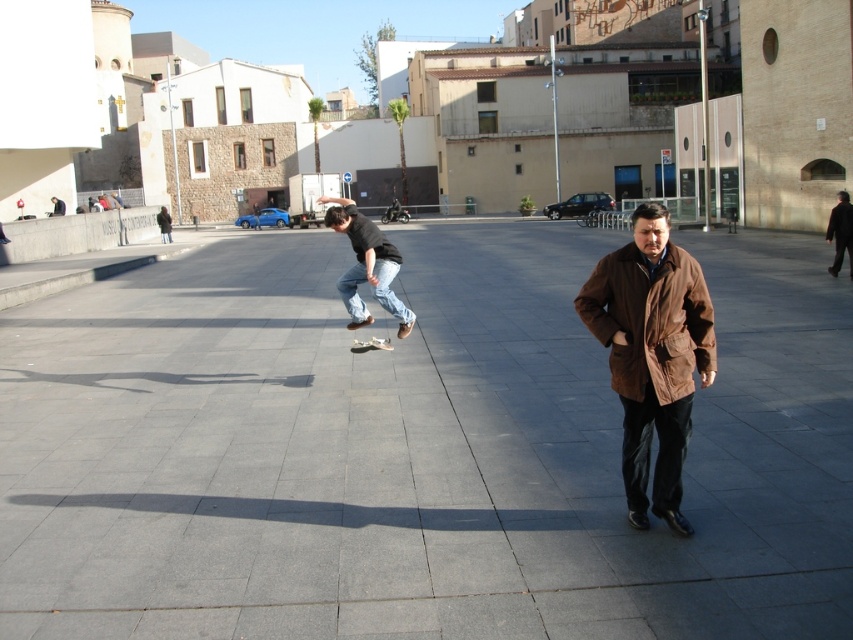
The image size is (853, 640). What do you see at coordinates (415, 451) in the screenshot?
I see `gray concrete pavement at center` at bounding box center [415, 451].

Between point (486, 570) and point (846, 248), which one is positioned in front?

Point (486, 570)

At what (x,y) coordinates should I click in order to perform the action: click on gray concrete pavement at center. Please return your answer as a coordinate pair (x, y). Image resolution: width=853 pixels, height=640 pixels. Looking at the image, I should click on (415, 451).

You are a GUI agent. You are given a task and a screenshot of the screen. Output one action in this format:
    pyautogui.click(x=<x>, y=<y>)
    Task: Click on the gray concrete pavement at center
    Image resolution: width=853 pixels, height=640 pixels.
    Given the screenshot: What is the action you would take?
    pyautogui.click(x=415, y=451)

Is gray concrete pavement at center wider than wooden smooth skateboard at center?

Indeed, gray concrete pavement at center has a greater width compared to wooden smooth skateboard at center.

Can you confirm if gray concrete pavement at center is bigger than wooden smooth skateboard at center?

Correct, gray concrete pavement at center is larger in size than wooden smooth skateboard at center.

Who is more forward, (22, 442) or (376, 346)?

Point (22, 442) is in front.

I want to click on gray concrete pavement at center, so click(415, 451).

Does brown leather coat at right have a smaller size compared to denim jeans at center?

Yes, brown leather coat at right is smaller than denim jeans at center.

Who is more forward, (584, 282) or (355, 256)?

Positioned in front is point (584, 282).

Find the location of `brown leather coat at right`. brown leather coat at right is located at coordinates (651, 355).